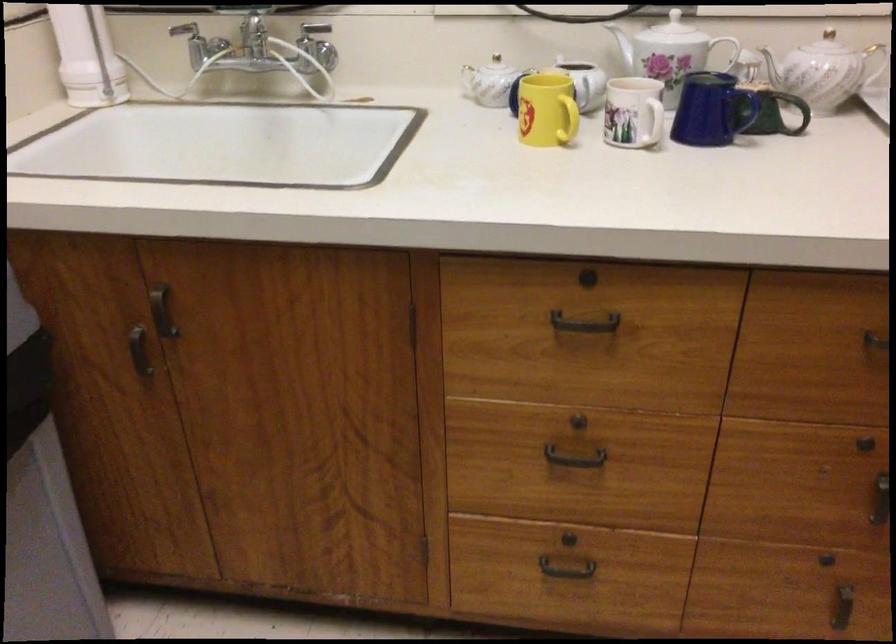
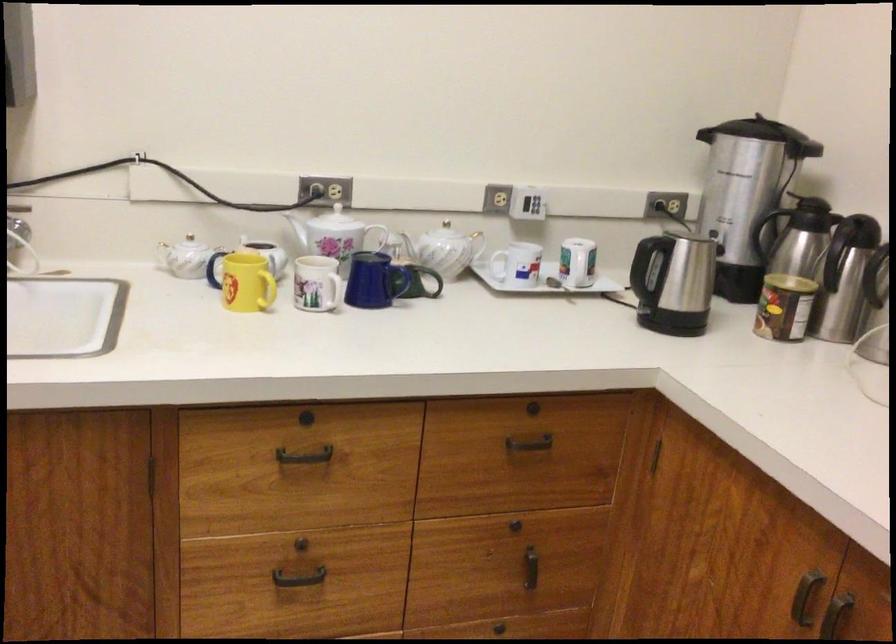
Locate, in the second image, the point that corresponds to (538,105) in the first image.

(245, 281)